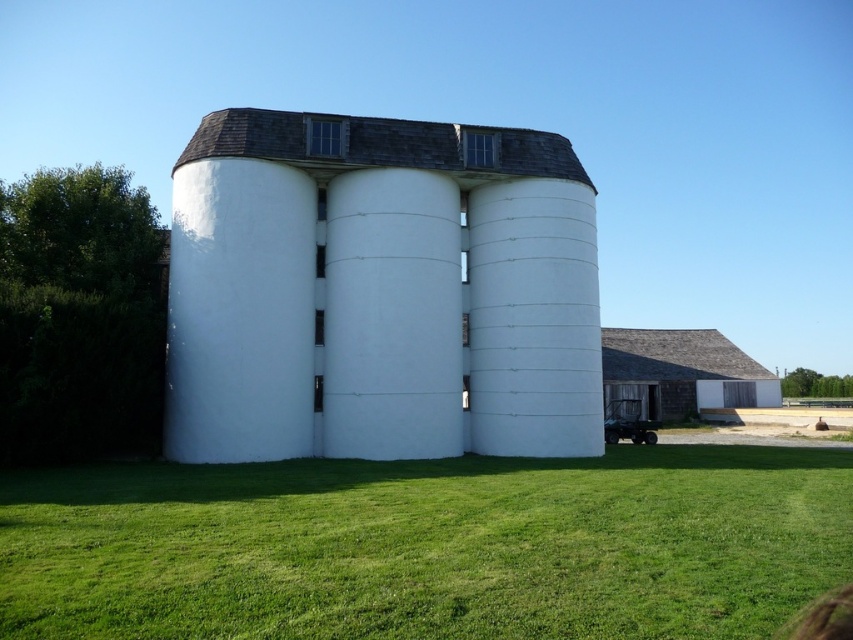
You are standing at the base of the silo and want to walk directly towards the green grass at center. Which direction should you head?

Since the green grass at center is located at coordinates point (427,545), you should head towards the direction where the x coordinate increases, which would be to the right side from the silo.

You are standing in front of the white smooth silo at center and want to walk to the green grass at center. Is the path clear?

The green grass at center occupies less space than the white smooth silo at center, so the path may be obstructed by the silo itself.